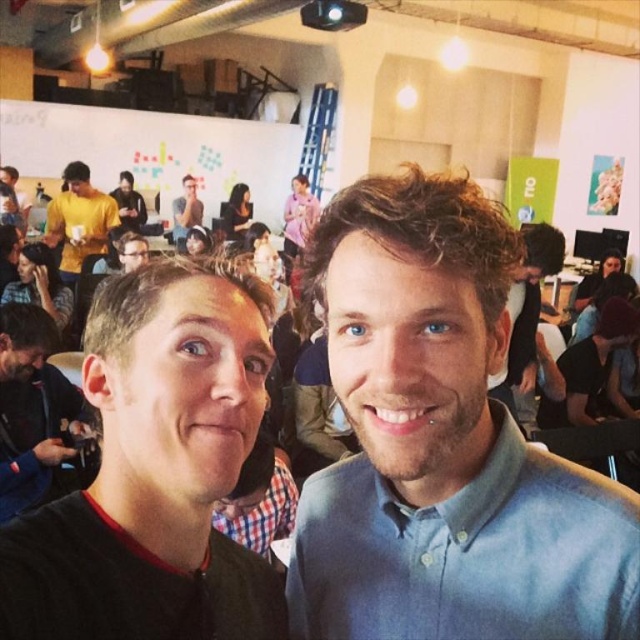
Which of these two, black matte shirt at center or yellow matte shirt at upper left, stands shorter?

With less height is black matte shirt at center.

Is point (228, 465) positioned behind point (83, 209)?

No.

Locate an element on the screen. Image resolution: width=640 pixels, height=640 pixels. black matte shirt at center is located at coordinates (156, 470).

Is yellow matte shirt at upper left above matte gray shirt at upper center?

No, yellow matte shirt at upper left is not above matte gray shirt at upper center.

Is yellow matte shirt at upper left positioned in front of matte gray shirt at upper center?

That is True.

The height and width of the screenshot is (640, 640). Identify the location of yellow matte shirt at upper left. (77, 220).

Identify the location of yellow matte shirt at upper left. The height and width of the screenshot is (640, 640). (77, 220).

How distant is black leather jacket at left from yellow matte shirt at upper left?

black leather jacket at left is 2.28 meters away from yellow matte shirt at upper left.

The width and height of the screenshot is (640, 640). Describe the element at coordinates (33, 412) in the screenshot. I see `black leather jacket at left` at that location.

The height and width of the screenshot is (640, 640). Find the location of `black leather jacket at left`. black leather jacket at left is located at coordinates click(33, 412).